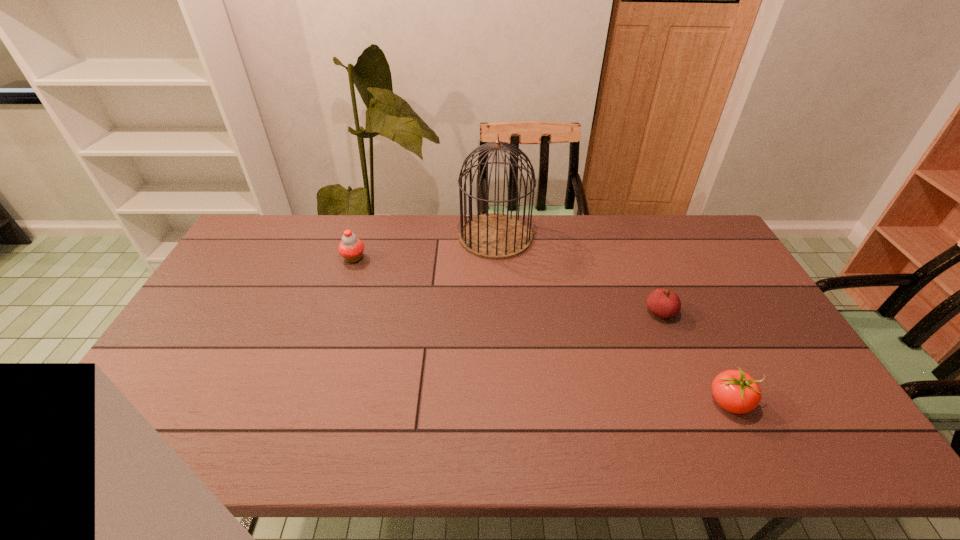
The image size is (960, 540). What are the coordinates of `cupcake that is positioned at the far edge` in the screenshot? It's located at (351, 248).

Identify the location of object at the near edge. Image resolution: width=960 pixels, height=540 pixels. (735, 391).

In the image, there is a desktop. Identify the location of vacant space at the far edge. 574,226.

In order to click on vacant space at the near edge of the desktop in this screenshot , I will do `click(354, 438)`.

Locate an element on the screen. Image resolution: width=960 pixels, height=540 pixels. vacant point at the left edge is located at coordinates (222, 321).

This screenshot has width=960, height=540. In the image, there is a desktop. In order to click on blank space at the right edge in this screenshot , I will do `click(750, 342)`.

What are the coordinates of `vacant space at the far left corner` in the screenshot? It's located at (269, 217).

In the image, there is a desktop. Where is `free space at the far right corner`? free space at the far right corner is located at coordinates (717, 249).

Locate an element on the screen. Image resolution: width=960 pixels, height=540 pixels. free spot between the leftmost object and the second nearest object is located at coordinates (507, 285).

The width and height of the screenshot is (960, 540). I want to click on vacant space that's between the farther tomato and the third object from right to left, so click(x=578, y=274).